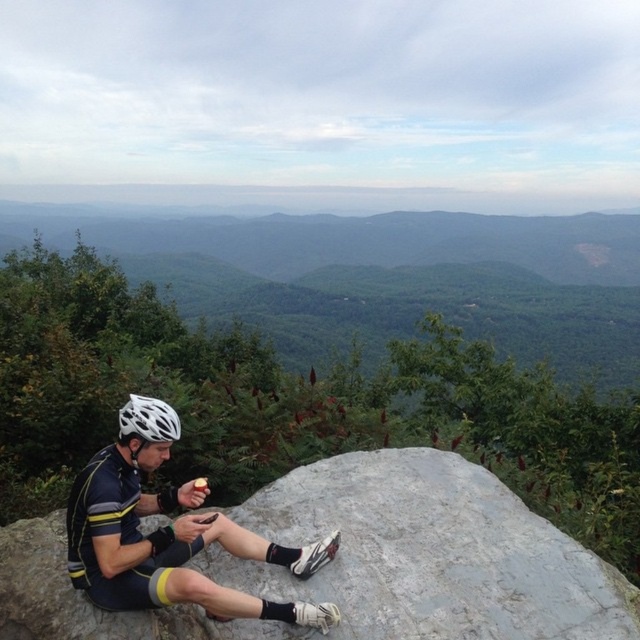
Question: Estimate the real-world distances between objects in this image. Which object is closer to the matte black helmet at center?

Choices:
 (A) gray textured rock at center
 (B) green leafy mountain at center
 (C) white matte bicycle helmet at left

Answer: (C)

Question: Among these points, which one is nearest to the camera?

Choices:
 (A) (173, 412)
 (B) (337, 544)
 (C) (440, 284)

Answer: (B)

Question: Does gray textured rock at center lie in front of matte black helmet at center?

Choices:
 (A) no
 (B) yes

Answer: (A)

Question: Which point appears farthest from the camera in this image?

Choices:
 (A) (152, 403)
 (B) (172, 436)

Answer: (A)

Question: Is green leafy mountain at center positioned in front of matte black helmet at center?

Choices:
 (A) no
 (B) yes

Answer: (A)

Question: Can you confirm if gray textured rock at center is thinner than green leafy mountain at center?

Choices:
 (A) yes
 (B) no

Answer: (A)